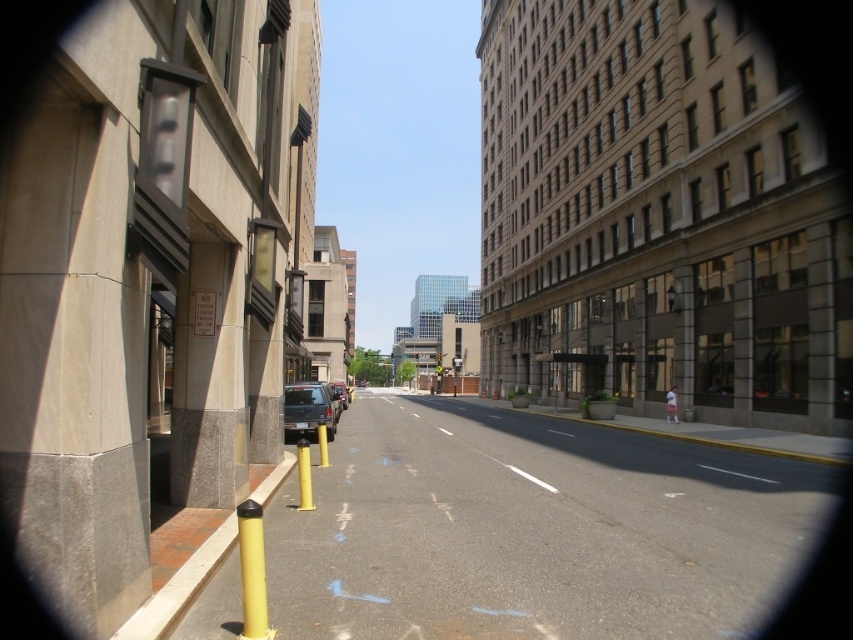
Can you confirm if yellow matte pole at lower left is taller than yellow rubber pole at center?

Correct, yellow matte pole at lower left is much taller as yellow rubber pole at center.

Is yellow matte pole at lower left further to camera compared to yellow rubber pole at center?

That is False.

Is point (305, 502) closer to camera compared to point (325, 460)?

Yes, it is.

Identify the location of yellow matte pole at lower left. (305, 476).

Does yellow matte pole at center appear on the right side of yellow matte pole at lower left?

Yes, yellow matte pole at center is to the right of yellow matte pole at lower left.

Is point (267, 628) farther from viewer compared to point (299, 484)?

No, (267, 628) is in front of (299, 484).

Does point (254, 518) come closer to viewer compared to point (300, 484)?

Yes, point (254, 518) is in front of point (300, 484).

At what (x,y) coordinates should I click in order to perform the action: click on yellow matte pole at center. Please return your answer as a coordinate pair (x, y). Looking at the image, I should click on (252, 572).

Is point (294, 499) positioned after point (322, 444)?

No.

Where is `yellow asphalt at lower left`? This screenshot has height=640, width=853. yellow asphalt at lower left is located at coordinates (532, 529).